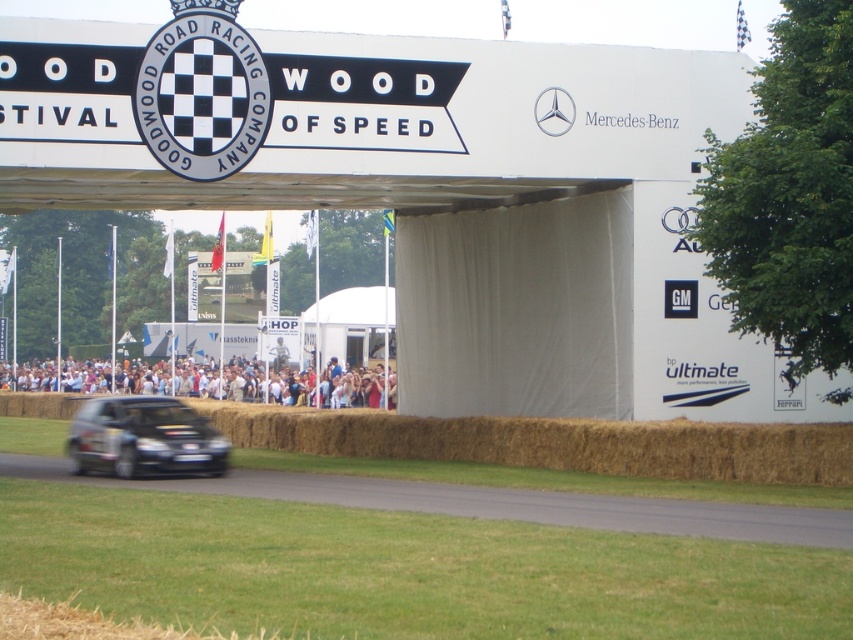
Based on the photo, you are a photographer at the Goodwood Festival of Speed. You need to capture a photo of the black glossy hatchback at lower left while ensuring the black asphalt road at lower center is visible in the background. Can the road be fully visible behind the car?

The black asphalt road at lower center is wider than the black glossy hatchback at lower left, so the road can be fully visible behind the car in the photo.

You are a photographer at the Goodwood Festival of Speed. You need to capture a photo of the black asphalt road at lower center and the black glossy hatchback at lower left. Which object is shorter in height?

The black asphalt road at lower center is shorter than the black glossy hatchback at lower left.